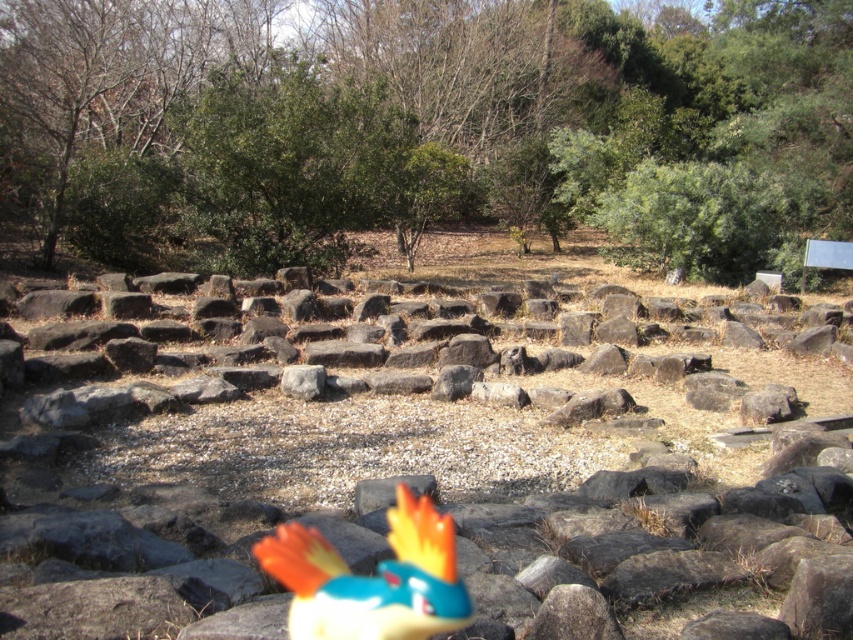
Question: Can you confirm if green leafy tree at upper center is positioned to the right of smooth gray rocks at center?

Choices:
 (A) no
 (B) yes

Answer: (B)

Question: Which object is positioned closest to the shiny plastic bird at center?

Choices:
 (A) smooth gray rocks at center
 (B) green leafy tree at upper center

Answer: (A)

Question: Which object is closer to the camera taking this photo?

Choices:
 (A) smooth gray rocks at center
 (B) shiny plastic bird at center
 (C) green leafy tree at upper center

Answer: (A)

Question: Is green leafy tree at upper center above shiny plastic bird at center?

Choices:
 (A) no
 (B) yes

Answer: (B)

Question: Which object is the farthest from the shiny plastic bird at center?

Choices:
 (A) smooth gray rocks at center
 (B) green leafy tree at upper center

Answer: (B)

Question: Is smooth gray rocks at center below shiny plastic bird at center?

Choices:
 (A) yes
 (B) no

Answer: (B)